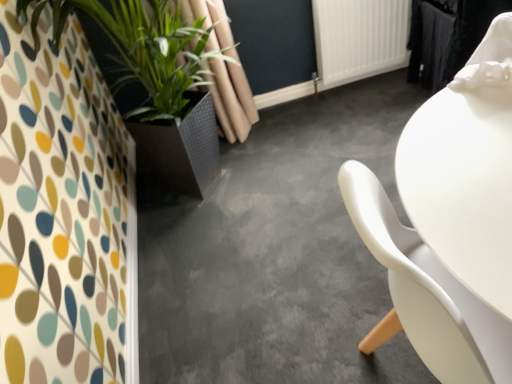
Question: Which is correct: white plastic radiator at upper center is inside green leafy plant at left, or outside of it?

Choices:
 (A) inside
 (B) outside

Answer: (B)

Question: Considering their positions, is white plastic radiator at upper center located in front of or behind green leafy plant at left?

Choices:
 (A) front
 (B) behind

Answer: (B)

Question: Estimate the real-world distances between objects in this image. Which object is farther from the concretesmoothfloor at center?

Choices:
 (A) white plastic radiator at upper center
 (B) green leafy plant at left

Answer: (A)

Question: Considering the real-world distances, which object is closest to the white plastic radiator at upper center?

Choices:
 (A) concretesmoothfloor at center
 (B) green leafy plant at left

Answer: (A)